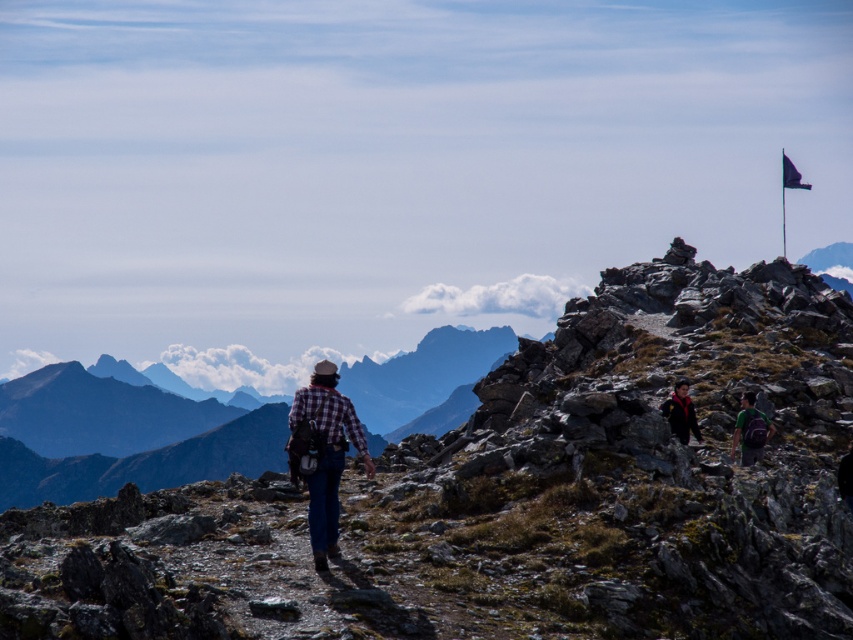
Question: Is rugged stone mountain at upper right below black fabric flag at upper right?

Choices:
 (A) yes
 (B) no

Answer: (A)

Question: Does plaid fabric shirt at center appear on the right side of black fleece jacket at upper right?

Choices:
 (A) no
 (B) yes

Answer: (A)

Question: Considering the relative positions of plaid fabric shirt at center and black fabric flag at upper right in the image provided, where is plaid fabric shirt at center located with respect to black fabric flag at upper right?

Choices:
 (A) left
 (B) right

Answer: (A)

Question: Considering the real-world distances, which object is farthest from the plaid fabric shirt at center?

Choices:
 (A) black fabric flag at upper right
 (B) rugged stone mountain at upper right

Answer: (B)

Question: Which point is closer to the camera?

Choices:
 (A) (x=692, y=406)
 (B) (x=741, y=458)

Answer: (B)

Question: Among these points, which one is farthest from the camera?

Choices:
 (A) (809, 186)
 (B) (572, 554)
 (C) (672, 413)

Answer: (A)